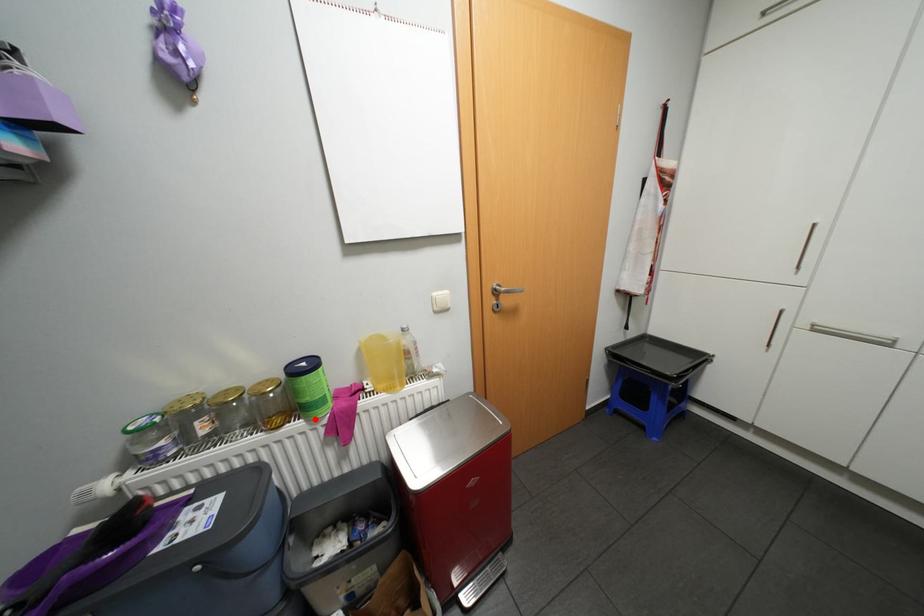
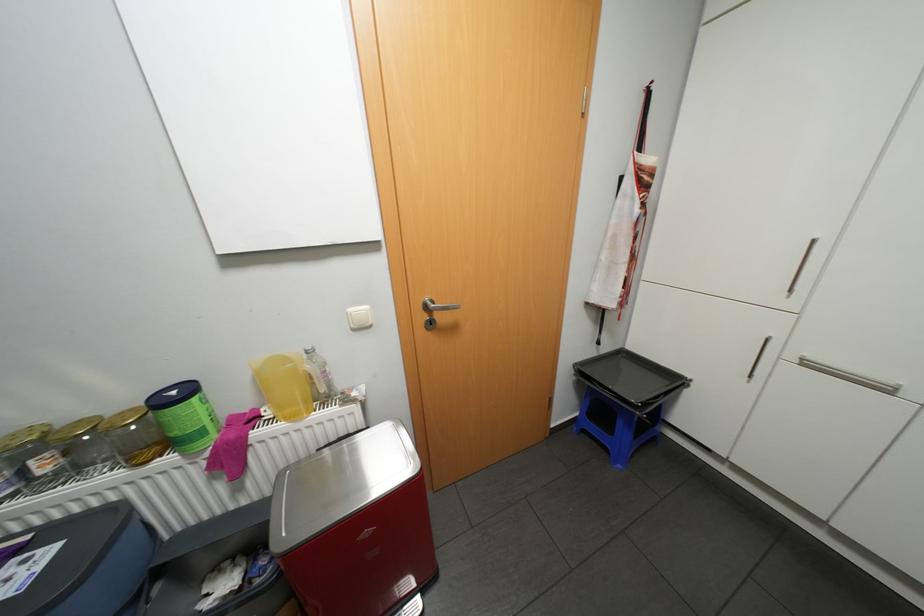
Where in the second image is the point corresponding to the highlighted location from the first image?

(190, 453)